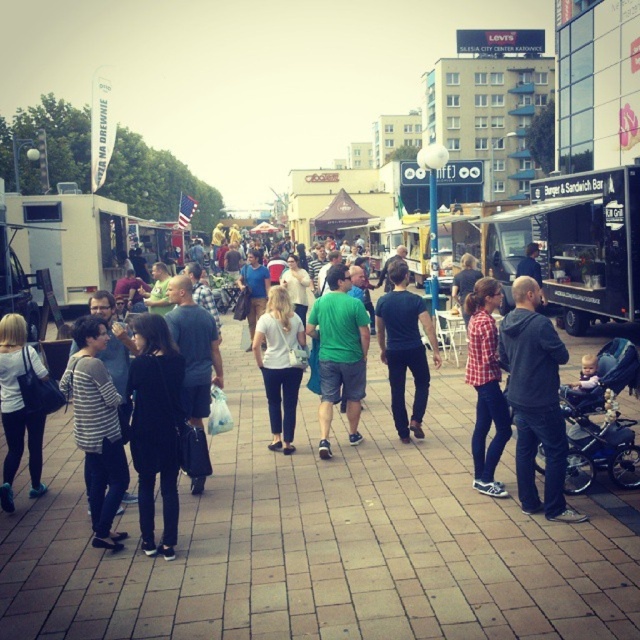
Does point (10, 403) come in front of point (205, 392)?

Yes, it is in front of point (205, 392).

What do you see at coordinates (19, 408) in the screenshot?
I see `matte black jacket at lower left` at bounding box center [19, 408].

Does point (4, 419) come behind point (196, 385)?

No, it is in front of (196, 385).

The image size is (640, 640). Identify the location of matte black jacket at lower left. (19, 408).

Can you confirm if dark blue jeans at center is bigger than matte gray shirt at center?

Indeed, dark blue jeans at center has a larger size compared to matte gray shirt at center.

Can you confirm if dark blue jeans at center is positioned below matte gray shirt at center?

Actually, dark blue jeans at center is above matte gray shirt at center.

Is point (388, 355) closer to viewer compared to point (188, 364)?

No, (388, 355) is further to viewer.

Identify the location of dark blue jeans at center. The height and width of the screenshot is (640, 640). 404,348.

Which is in front, point (548, 488) or point (288, 324)?

Point (548, 488)

Is dark gray hoodie at center further to the viewer compared to white matte shirt at center?

No, dark gray hoodie at center is in front of white matte shirt at center.

At what (x,y) coordinates should I click in order to perform the action: click on dark gray hoodie at center. Please return your answer as a coordinate pair (x, y). This screenshot has width=640, height=640. Looking at the image, I should click on click(536, 401).